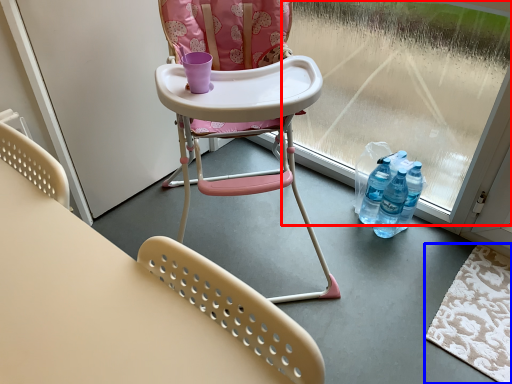
Question: Which point is further to the camera, window screen (highlighted by a red box) or mat (highlighted by a blue box)?

Choices:
 (A) window screen
 (B) mat

Answer: (B)